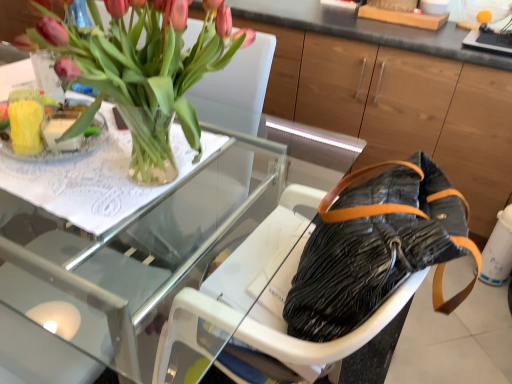
Question: Is pink matte tulips at upper left inside the boundaries of transparent glass table at upper left, or outside?

Choices:
 (A) outside
 (B) inside

Answer: (A)

Question: From the image's perspective, relative to transparent glass table at upper left, is pink matte tulips at upper left above or below?

Choices:
 (A) above
 (B) below

Answer: (A)

Question: Which is nearer to the clear glass vase at upper left?

Choices:
 (A) transparent glass table at upper left
 (B) black matte bag at lower right
 (C) pink matte tulips at upper left
 (D) black fabric armchair at center
 (E) leather handbag at center

Answer: (C)

Question: Which object is positioned closest to the black fabric armchair at center?

Choices:
 (A) transparent glass table at upper left
 (B) clear glass vase at upper left
 (C) black matte bag at lower right
 (D) leather handbag at center
 (E) pink matte tulips at upper left

Answer: (D)